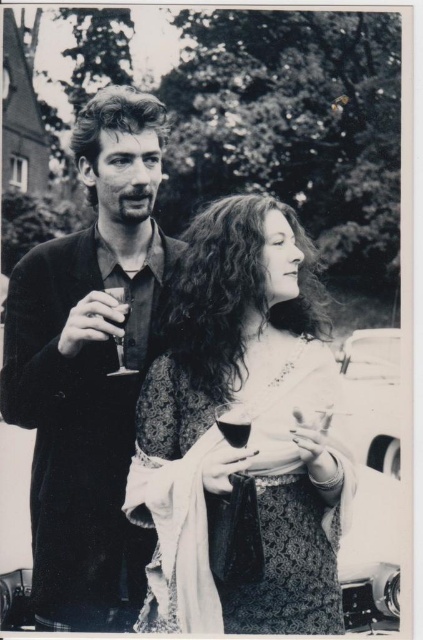
Question: Can you confirm if translucent glass wine at center is positioned to the left of clear glass wine glass at left?

Choices:
 (A) no
 (B) yes

Answer: (A)

Question: Does patterned fabric dress at center have a lesser width compared to translucent glass wine at center?

Choices:
 (A) yes
 (B) no

Answer: (B)

Question: Which object is closer to the camera taking this photo?

Choices:
 (A) clear glass wine at left
 (B) clear glass wine glass at left
 (C) patterned fabric dress at center
 (D) dark wool coat at left

Answer: (C)

Question: Which is nearer to the translucent glass wine at upper center?

Choices:
 (A) clear glass wine glass at left
 (B) translucent glass wine at center
 (C) clear glass wine at left

Answer: (B)

Question: Can you confirm if patterned fabric dress at center is positioned to the left of translucent glass wine at center?

Choices:
 (A) yes
 (B) no

Answer: (B)

Question: Which is farther from the patterned fabric dress at center?

Choices:
 (A) translucent glass wine at center
 (B) clear glass wine glass at left
 (C) dark wool coat at left
 (D) translucent glass wine at upper center

Answer: (B)